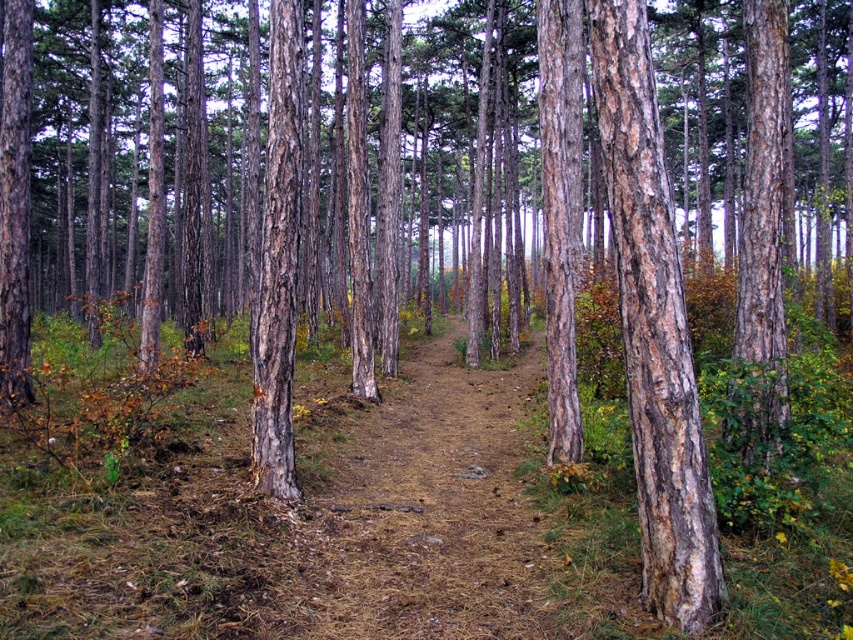
Who is taller, brown dirt trail at center or smooth brown bark at center?

smooth brown bark at center

Is point (498, 412) positioned after point (697, 552)?

That is True.

Where is `brown dirt trail at center`? brown dirt trail at center is located at coordinates (428, 506).